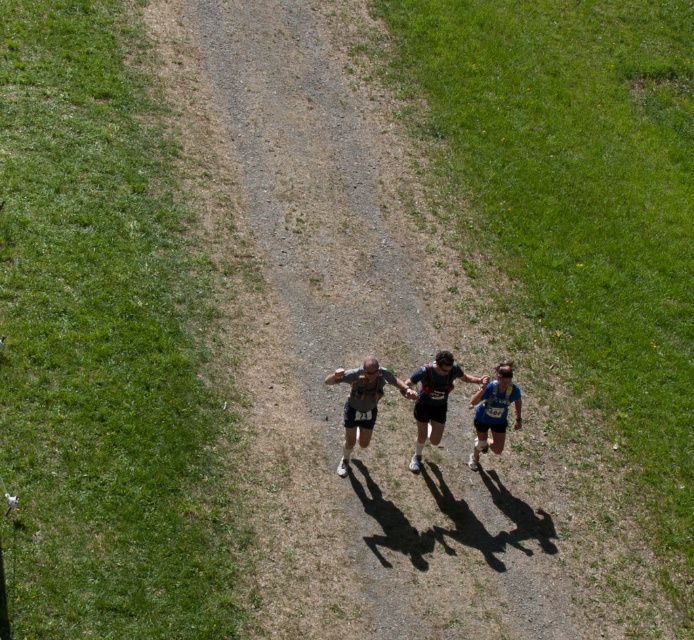
Can you confirm if matte gray tank top at center is smaller than black fabric running suit at center?

Actually, matte gray tank top at center might be larger than black fabric running suit at center.

Can you confirm if matte gray tank top at center is shorter than black fabric running suit at center?

Yes, matte gray tank top at center is shorter than black fabric running suit at center.

What do you see at coordinates (362, 403) in the screenshot?
I see `matte gray tank top at center` at bounding box center [362, 403].

The image size is (694, 640). I want to click on matte gray tank top at center, so click(362, 403).

Does point (416, 397) lie in front of point (486, 408)?

Yes, it is in front of point (486, 408).

Which is below, black fabric running suit at center or blue fabric runner at center?

blue fabric runner at center

Who is more forward, (448,394) or (489,420)?

Positioned in front is point (448,394).

Where is `black fabric running suit at center`? Image resolution: width=694 pixels, height=640 pixels. black fabric running suit at center is located at coordinates (434, 397).

Which of these two, matte running gear at center or matte gray tank top at center, stands shorter?

matte gray tank top at center

Who is positioned more to the left, matte running gear at center or matte gray tank top at center?

From the viewer's perspective, matte gray tank top at center appears more on the left side.

Between point (448, 380) and point (355, 417), which one is positioned behind?

Point (355, 417)

At what (x,y) coordinates should I click in order to perform the action: click on matte running gear at center. Please return your answer as a coordinate pair (x, y). Looking at the image, I should click on (432, 397).